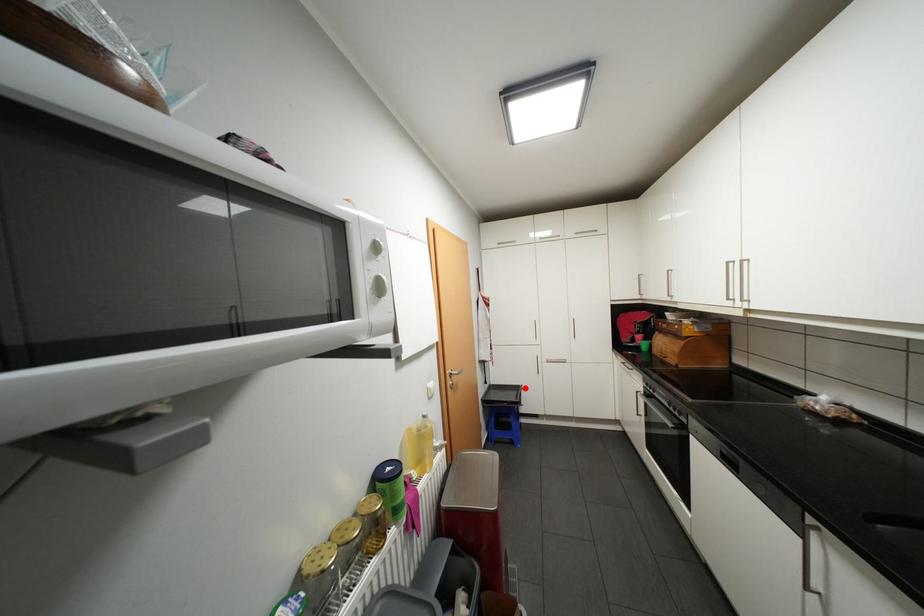
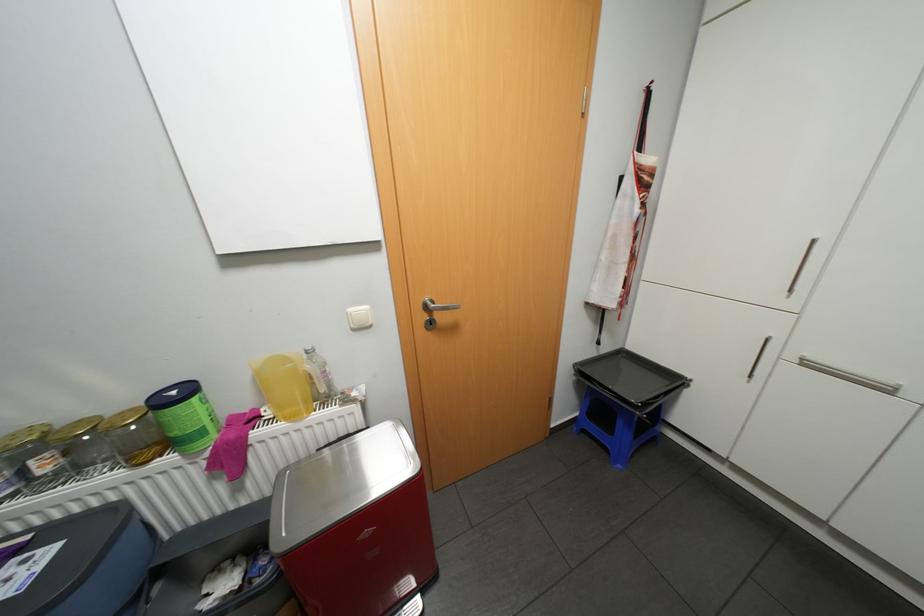
Locate, in the second image, the point that corresponds to the highlighted location in the first image.

(684, 379)